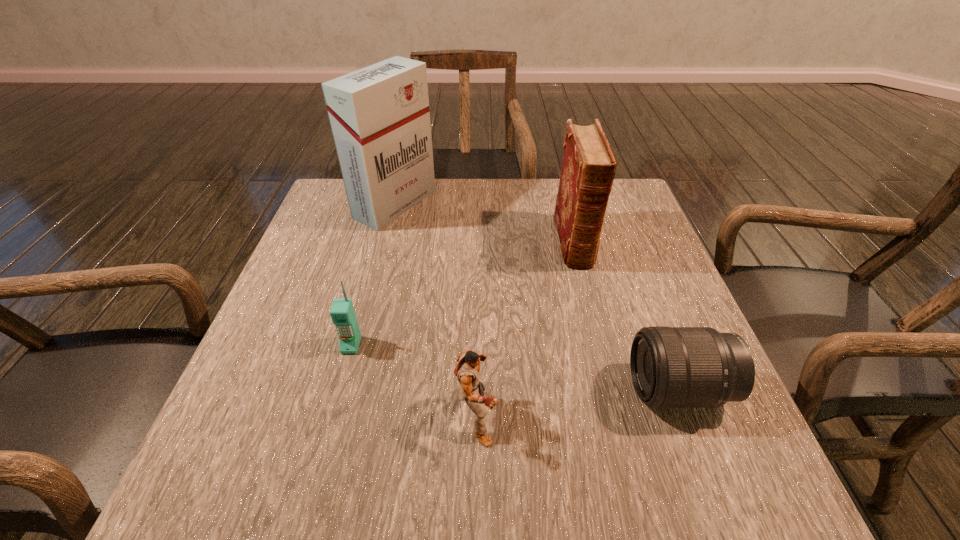
Locate an element on the screen. Image resolution: width=960 pixels, height=540 pixels. vacant region at the near edge of the desktop is located at coordinates (480, 458).

Find the location of a particular element. The image size is (960, 540). vacant space at the left edge is located at coordinates (333, 258).

The height and width of the screenshot is (540, 960). Find the location of `free space at the right edge of the desktop`. free space at the right edge of the desktop is located at coordinates (646, 261).

The image size is (960, 540). In the image, there is a desktop. In order to click on free space at the far left corner in this screenshot , I will do `click(317, 225)`.

At what (x,y) coordinates should I click in order to perform the action: click on free space at the near left corner. Please return your answer as a coordinate pair (x, y). Image resolution: width=960 pixels, height=540 pixels. Looking at the image, I should click on (246, 460).

Identify the location of vacant area that lies between the third farthest object and the tallest object. The image size is (960, 540). (373, 275).

Identify the location of free space between the second object from right to left and the rightmost object. This screenshot has width=960, height=540. (626, 315).

Where is `vacant space that is in between the cigarette case and the puncher`? vacant space that is in between the cigarette case and the puncher is located at coordinates (436, 309).

The image size is (960, 540). Identify the location of free spot between the hardback book and the puncher. (525, 328).

This screenshot has height=540, width=960. I want to click on free space between the third object from left to right and the third farthest object, so [x=414, y=380].